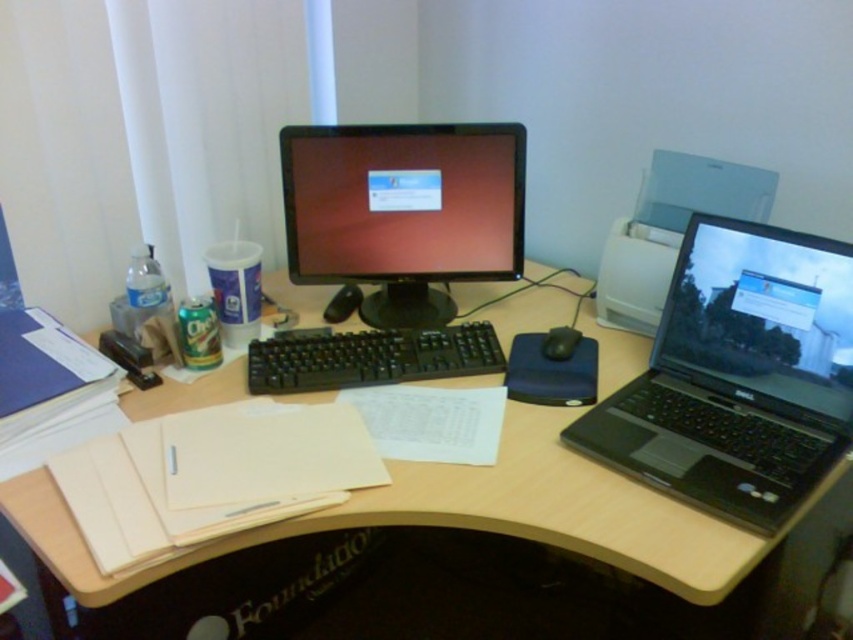
Question: Is matte black laptop at right in front of black plastic keyboard at center?

Choices:
 (A) yes
 (B) no

Answer: (A)

Question: Which point is closer to the camera?

Choices:
 (A) click(508, 324)
 (B) click(451, 328)
 (C) click(804, 250)
 (D) click(550, 346)

Answer: (C)

Question: Which of the following is the farthest from the observer?

Choices:
 (A) wooden at center
 (B) black plastic keyboard at center
 (C) matte black monitor at center
 (D) black rubber mouse at center

Answer: (C)

Question: Estimate the real-world distances between objects in this image. Which object is farther from the matte black monitor at center?

Choices:
 (A) wooden at center
 (B) black plastic laptop at right

Answer: (B)

Question: Does matte black monitor at center appear on the left side of black rubber mouse at center?

Choices:
 (A) no
 (B) yes

Answer: (B)

Question: Can you confirm if black plastic laptop at right is positioned above matte black laptop at right?

Choices:
 (A) no
 (B) yes

Answer: (A)